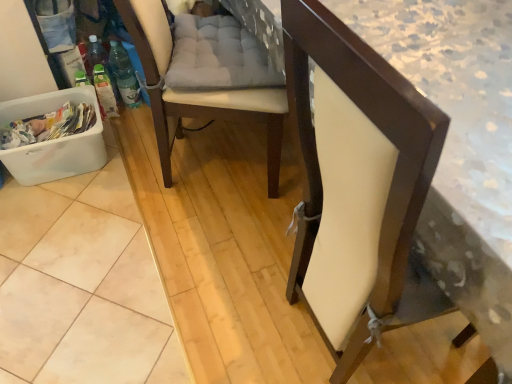
Where is `vacant area to the left of matte white chair at center, which is the 1th chair in right-to-left order`? The width and height of the screenshot is (512, 384). vacant area to the left of matte white chair at center, which is the 1th chair in right-to-left order is located at coordinates (215, 294).